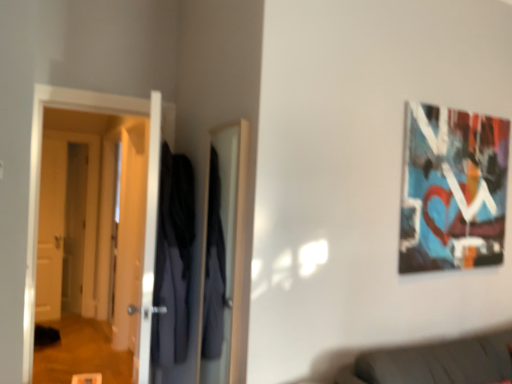
Describe the element at coordinates (67, 224) in the screenshot. Image resolution: width=512 pixels, height=384 pixels. I see `white wooden door at left, which is the second door from right to left` at that location.

Where is `white wooden door at left, which is the third door in front-to-back order`? The height and width of the screenshot is (384, 512). white wooden door at left, which is the third door in front-to-back order is located at coordinates (67, 224).

The image size is (512, 384). What do you see at coordinates (173, 259) in the screenshot?
I see `dark blue fabric robe at center` at bounding box center [173, 259].

What is the approximate height of white glossy door at left, marked as the 3th door in a left-to-right arrangement?

1.83 meters.

Measure the distance between white glossy door at left, marked as the 3th door in a left-to-right arrangement, and camera.

They are 6.45 feet apart.

At what (x,y) coordinates should I click in order to perform the action: click on wooden door at left, arranged as the second door when viewed from the front. Please return your answer as a coordinate pair (x, y). The image size is (512, 384). Looking at the image, I should click on (51, 230).

The image size is (512, 384). Describe the element at coordinates (51, 230) in the screenshot. I see `wooden door at left, acting as the 3th door starting from the right` at that location.

Locate an element on the screen. The height and width of the screenshot is (384, 512). white wooden door at left, which is the second door from right to left is located at coordinates (67, 224).

What's the angular difference between dark blue fabric robe at center and wooden door at left, acting as the 3th door starting from the right,'s facing directions?

The facing directions of dark blue fabric robe at center and wooden door at left, acting as the 3th door starting from the right, are 56.4 degrees apart.

Considering the sizes of dark blue fabric robe at center and wooden door at left, acting as the 3th door starting from the right, in the image, is dark blue fabric robe at center taller or shorter than wooden door at left, acting as the 3th door starting from the right,?

Considering their sizes, dark blue fabric robe at center has less height than wooden door at left, acting as the 3th door starting from the right.

From the image's perspective, does dark blue fabric robe at center appear lower than wooden door at left, arranged as the second door when viewed from the front?

Incorrect, from the image's perspective, dark blue fabric robe at center is higher than wooden door at left, arranged as the second door when viewed from the front.

From a real-world perspective, who is located higher, dark blue fabric robe at center or wooden door at left, arranged as the second door when viewed from the front?

From a 3D spatial view, dark blue fabric robe at center is above.

Is wooden door at left, acting as the 3th door starting from the right, smaller than white wooden door at left, which is the second door from right to left?

Yes.

From the image's perspective, which object appears higher, wooden door at left, acting as the 3th door starting from the right, or white wooden door at left, which is the second door from right to left?

white wooden door at left, which is the second door from right to left.

Is point (39, 312) positioned before point (91, 248)?

Yes, point (39, 312) is in front of point (91, 248).

Are wooden door at left, the 1th door in the left-to-right sequence, and white wooden door at left, positioned as the 2th door in left-to-right order, located far from each other?

No, there isn't a large distance between wooden door at left, the 1th door in the left-to-right sequence, and white wooden door at left, positioned as the 2th door in left-to-right order.

Can you confirm if white glossy door at left, arranged as the 1th door when viewed from the right, is taller than matte canvas painting at upper right?

Indeed, white glossy door at left, arranged as the 1th door when viewed from the right, has a greater height compared to matte canvas painting at upper right.

Choose the correct answer: Is white glossy door at left, arranged as the 1th door when viewed from the right, inside matte canvas painting at upper right or outside it?

white glossy door at left, arranged as the 1th door when viewed from the right, lies outside matte canvas painting at upper right.

Which of these two, white glossy door at left, marked as the 3th door in a left-to-right arrangement, or matte canvas painting at upper right, is bigger?

With larger size is white glossy door at left, marked as the 3th door in a left-to-right arrangement.

Are white glossy door at left, arranged as the 1th door when viewed from the right, and matte canvas painting at upper right beside each other?

white glossy door at left, arranged as the 1th door when viewed from the right, and matte canvas painting at upper right are not in contact.

Is white wooden door at left, which is the second door from right to left, taller or shorter than wooden door at left, acting as the 3th door starting from the right?

Clearly, white wooden door at left, which is the second door from right to left, is taller compared to wooden door at left, acting as the 3th door starting from the right.

Between white wooden door at left, which is the second door from right to left, and wooden door at left, the 1th door in the left-to-right sequence, which one has larger size?

Bigger between the two is white wooden door at left, which is the second door from right to left.

Considering the positions of point (66, 152) and point (60, 208), is point (66, 152) closer or farther from the camera than point (60, 208)?

Point (66, 152).

Is wooden door at left, which is counted as the 2th door, starting from the back, facing away from white glossy door at left, marked as the 3th door in a left-to-right arrangement?

No, wooden door at left, which is counted as the 2th door, starting from the back, is not facing the opposite direction of white glossy door at left, marked as the 3th door in a left-to-right arrangement.

Between wooden door at left, the 1th door in the left-to-right sequence, and white glossy door at left, arranged as the 1th door when viewed from the right, which one appears on the right side from the viewer's perspective?

white glossy door at left, arranged as the 1th door when viewed from the right.

Is wooden door at left, acting as the 3th door starting from the right, positioned before white glossy door at left, marked as the 3th door in a left-to-right arrangement?

No, the depth of wooden door at left, acting as the 3th door starting from the right, is greater than that of white glossy door at left, marked as the 3th door in a left-to-right arrangement.

Between wooden door at left, acting as the 3th door starting from the right, and white glossy door at left, the first door viewed from the front, which one has less height?

With less height is white glossy door at left, the first door viewed from the front.

Is matte canvas painting at upper right completely or partially outside of dark blue fabric robe at center?

That's correct, matte canvas painting at upper right is outside of dark blue fabric robe at center.

Considering the relative sizes of matte canvas painting at upper right and dark blue fabric robe at center in the image provided, is matte canvas painting at upper right wider than dark blue fabric robe at center?

In fact, matte canvas painting at upper right might be narrower than dark blue fabric robe at center.

From the picture: Is matte canvas painting at upper right bigger or smaller than dark blue fabric robe at center?

Clearly, matte canvas painting at upper right is smaller in size than dark blue fabric robe at center.

Is matte canvas painting at upper right oriented towards dark blue fabric robe at center?

No, matte canvas painting at upper right is not aimed at dark blue fabric robe at center.

Is white wooden door at left, which is the third door in front-to-back order, next to white glossy door at left, acting as the 3th door starting from the back?

No, white wooden door at left, which is the third door in front-to-back order, is not with white glossy door at left, acting as the 3th door starting from the back.

Who is taller, white wooden door at left, which is the second door from right to left, or white glossy door at left, marked as the 3th door in a left-to-right arrangement?

white wooden door at left, which is the second door from right to left, is taller.

From the image's perspective, does white wooden door at left, which is the third door in front-to-back order, appear higher than white glossy door at left, arranged as the 1th door when viewed from the right?

No, from the image's perspective, white wooden door at left, which is the third door in front-to-back order, is not on top of white glossy door at left, arranged as the 1th door when viewed from the right.

Is white wooden door at left, the 1th door in the back-to-front sequence, aimed at white glossy door at left, acting as the 3th door starting from the back?

Yes, white wooden door at left, the 1th door in the back-to-front sequence, is turned towards white glossy door at left, acting as the 3th door starting from the back.

Where is `the 2nd door positioned below the dark blue fabric robe at center (from a real-world perspective)`? the 2nd door positioned below the dark blue fabric robe at center (from a real-world perspective) is located at coordinates (51, 230).

At what (x,y) coordinates should I click in order to perform the action: click on door to the left of white wooden door at left, the 1th door in the back-to-front sequence. Please return your answer as a coordinate pair (x, y). This screenshot has width=512, height=384. Looking at the image, I should click on (51, 230).

Based on their spatial positions, is white glossy door at left, marked as the 3th door in a left-to-right arrangement, or white wooden door at left, which is the second door from right to left, closer to dark blue fabric robe at center?

white glossy door at left, marked as the 3th door in a left-to-right arrangement, is positioned closer to the anchor dark blue fabric robe at center.

Based on their spatial positions, is wooden door at left, arranged as the second door when viewed from the front, or dark blue fabric robe at center further from white wooden door at left, positioned as the 2th door in left-to-right order?

dark blue fabric robe at center is further to white wooden door at left, positioned as the 2th door in left-to-right order.

When comparing their distances from wooden door at left, which is counted as the 2th door, starting from the back, does white glossy door at left, marked as the 3th door in a left-to-right arrangement, or matte canvas painting at upper right seem further?

matte canvas painting at upper right lies further to wooden door at left, which is counted as the 2th door, starting from the back, than the other object.

When comparing their distances from white wooden door at left, which is the second door from right to left, does wooden door at left, the 1th door in the left-to-right sequence, or matte canvas painting at upper right seem closer?

The object closer to white wooden door at left, which is the second door from right to left, is wooden door at left, the 1th door in the left-to-right sequence.

Consider the image. Considering their positions, is white glossy door at left, marked as the 3th door in a left-to-right arrangement, positioned further to wooden door at left, arranged as the second door when viewed from the front, than dark blue fabric robe at center?

dark blue fabric robe at center is positioned further to the anchor wooden door at left, arranged as the second door when viewed from the front.

Looking at the image, which one is located closer to white glossy door at left, arranged as the 1th door when viewed from the right, matte canvas painting at upper right or white wooden door at left, which is the second door from right to left?

The object closer to white glossy door at left, arranged as the 1th door when viewed from the right, is matte canvas painting at upper right.

From the image, which object appears to be farther from dark blue fabric robe at center, white wooden door at left, the 1th door in the back-to-front sequence, or wooden door at left, the 1th door in the left-to-right sequence?

wooden door at left, the 1th door in the left-to-right sequence, is positioned further to the anchor dark blue fabric robe at center.

Which object lies nearer to the anchor point white glossy door at left, the first door viewed from the front, dark blue fabric robe at center or white wooden door at left, which is the second door from right to left?

dark blue fabric robe at center.

Locate an element on the screen. The image size is (512, 384). door between dark blue fabric robe at center and wooden door at left, arranged as the second door when viewed from the front, in the front-back direction is located at coordinates (40, 170).

Locate an element on the screen. The height and width of the screenshot is (384, 512). door positioned between white glossy door at left, arranged as the 1th door when viewed from the right, and white wooden door at left, the 1th door in the back-to-front sequence, from near to far is located at coordinates (51, 230).

Image resolution: width=512 pixels, height=384 pixels. I want to click on door between white wooden door at left, which is the second door from right to left, and matte canvas painting at upper right from left to right, so click(40, 170).

At what (x,y) coordinates should I click in order to perform the action: click on robe between white wooden door at left, which is the second door from right to left, and matte canvas painting at upper right, in the horizontal direction. Please return your answer as a coordinate pair (x, y). This screenshot has height=384, width=512. Looking at the image, I should click on (173, 259).